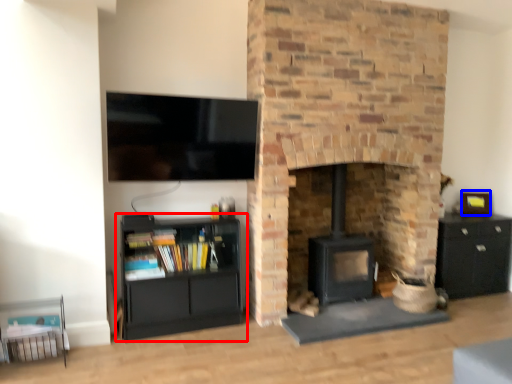
Question: Which point is further to the camera, shelf (highlighted by a red box) or picture frame (highlighted by a blue box)?

Choices:
 (A) shelf
 (B) picture frame

Answer: (B)